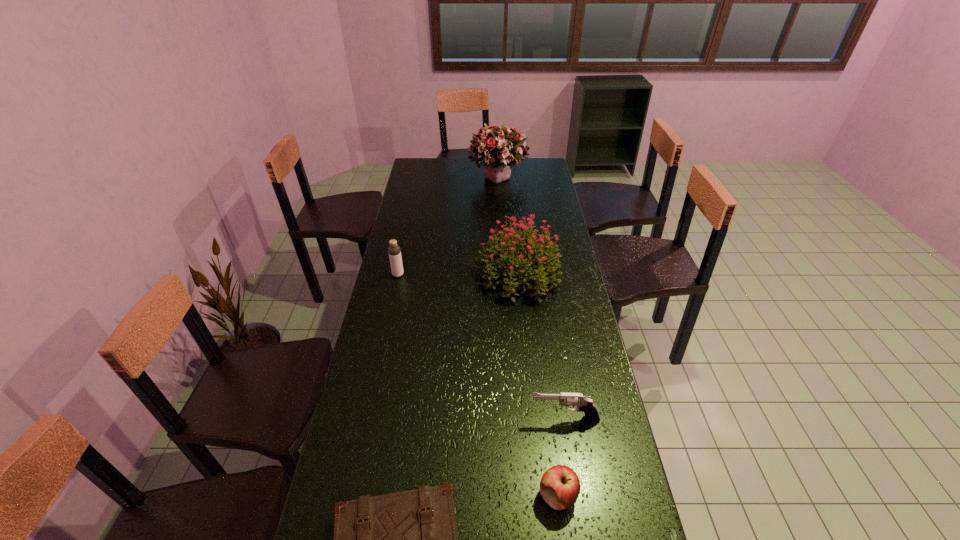
Where is `the farthest object`? Image resolution: width=960 pixels, height=540 pixels. the farthest object is located at coordinates (499, 148).

In order to click on the nearer bouquet in this screenshot , I will do `click(542, 263)`.

I want to click on bottle, so click(394, 251).

I want to click on the fourth tallest object, so click(x=584, y=404).

At what (x,y) coordinates should I click in order to perform the action: click on gun. Please return your answer as a coordinate pair (x, y). The width and height of the screenshot is (960, 540). Looking at the image, I should click on [x=584, y=404].

In order to click on apple in this screenshot , I will do `click(560, 487)`.

The width and height of the screenshot is (960, 540). In order to click on vacant space located 0.130m on the front of the farther bouquet in this screenshot , I will do `click(500, 207)`.

Identify the location of free location located on the front of the nearer bouquet. (526, 350).

Find the location of a particular element. free space located 0.320m on the front of the bottle is located at coordinates point(384,340).

This screenshot has width=960, height=540. What are the coordinates of `vacant space located at the muzzle of the gun` in the screenshot? It's located at (442, 418).